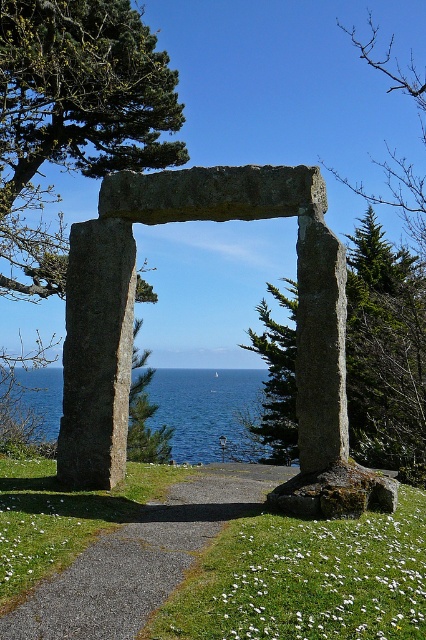
From the picture: You are standing in front of the granite stone arch at center and the smooth gray stone pillar at center. Which object is positioned more to the east if the sun is setting in the west?

The granite stone arch at center is positioned more to the east because it is to the right of the smooth gray stone pillar at center, and since the sun is setting in the west, the right side of the image would correspond to the east direction.

You are standing in front of the stone archway overlooking the ocean. You notice two points marked on the image. The first point is at coordinates point (408, 445) and the second point is at point (256, 442). Which point is closer to you?

Point (408, 445) is in front of point (256, 442), so the first point is closer to you.